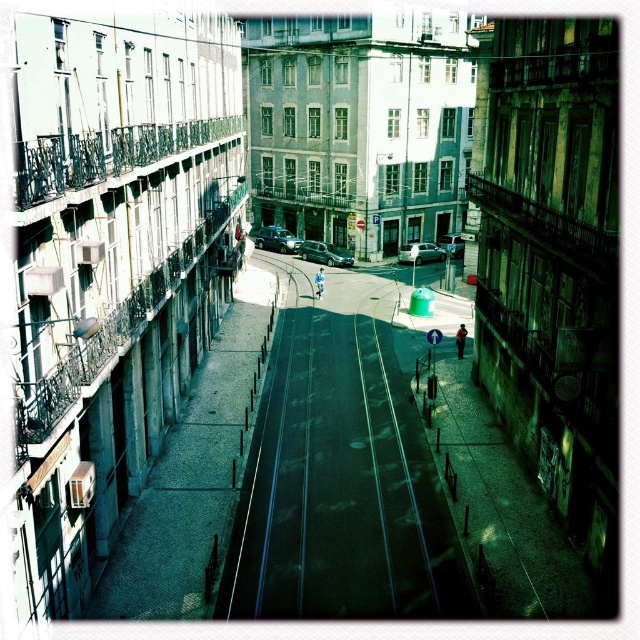
Question: Observing the image, what is the correct spatial positioning of shiny silver sedan at center in reference to silver metallic van at center?

Choices:
 (A) left
 (B) right

Answer: (A)

Question: Can you confirm if green rubber track at center is positioned below shiny silver car at center?

Choices:
 (A) no
 (B) yes

Answer: (B)

Question: Can you confirm if green rubber track at center is positioned to the left of silver metallic van at center?

Choices:
 (A) no
 (B) yes

Answer: (B)

Question: Which point is farther from the camera taking this photo?

Choices:
 (A) (413, 259)
 (B) (458, 250)

Answer: (B)

Question: Which point is closer to the camera?

Choices:
 (A) (307, 259)
 (B) (316, 598)
 (C) (259, 230)

Answer: (B)

Question: Which point is farther to the camera?

Choices:
 (A) shiny silver car at center
 (B) silver metallic van at center

Answer: (A)